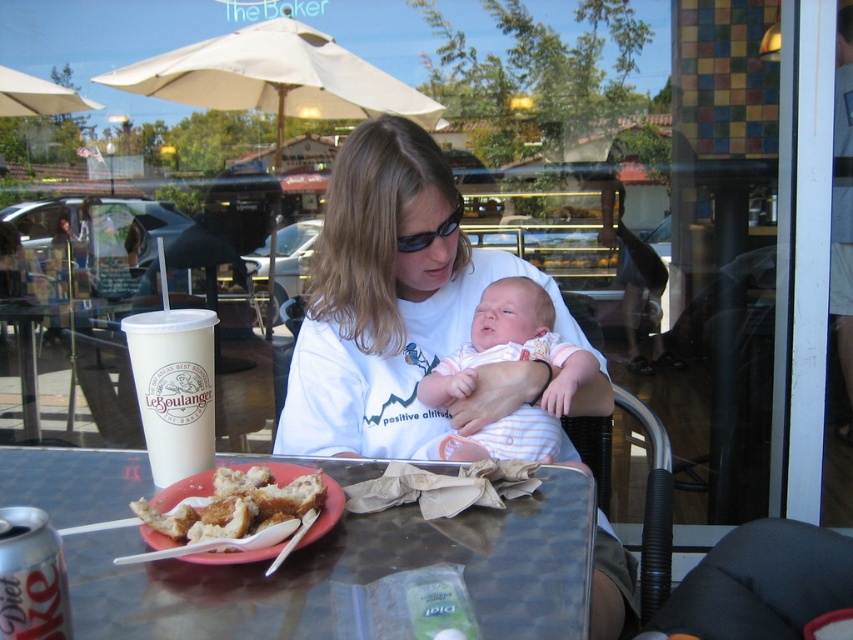
Which is in front, point (505, 456) or point (144, 534)?

Point (144, 534) is more forward.

Can you confirm if striped cotton onesie at center is thinner than golden fried pastry at center?

No.

Is point (553, 456) closer to camera compared to point (144, 534)?

That is False.

The image size is (853, 640). What are the coordinates of `striped cotton onesie at center` in the screenshot? It's located at [509, 360].

Which is below, metallic reflective table at center or white paper cup at table center?

metallic reflective table at center

Where is `metallic reflective table at center`? The image size is (853, 640). metallic reflective table at center is located at coordinates (354, 573).

Find the location of a particular element. The width and height of the screenshot is (853, 640). metallic reflective table at center is located at coordinates (354, 573).

Is metallic reflective table at center positioned before golden fried pastry at center?

Yes, it is in front of golden fried pastry at center.

Does point (13, 472) lie behind point (292, 467)?

Yes, it is behind point (292, 467).

This screenshot has width=853, height=640. Find the location of `metallic reflective table at center`. metallic reflective table at center is located at coordinates (354, 573).